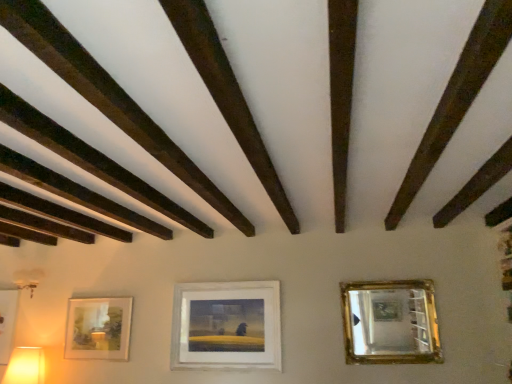
Question: Considering the positions of matte yellow plastic table lamp at lower left and dark brown wood at upper left in the image, is matte yellow plastic table lamp at lower left bigger or smaller than dark brown wood at upper left?

Choices:
 (A) small
 (B) big

Answer: (B)

Question: Considering the positions of matte yellow plastic table lamp at lower left and dark brown wood at upper left in the image, is matte yellow plastic table lamp at lower left taller or shorter than dark brown wood at upper left?

Choices:
 (A) tall
 (B) short

Answer: (A)

Question: Which of these objects is positioned closest to the gold-framed mirror at upper right?

Choices:
 (A) dark brown wood at upper left
 (B) matte white picture frame at center, arranged as the first picture frame when viewed from the right
 (C) matte white picture frame at lower left, the 2th picture frame positioned from the right
 (D) matte yellow plastic table lamp at lower left
 (E) matte white picture frame at lower left, acting as the third picture frame starting from the right

Answer: (B)

Question: Which object is the closest to the matte yellow plastic table lamp at lower left?

Choices:
 (A) matte white picture frame at center, arranged as the third picture frame when viewed from the left
 (B) dark brown wood at upper left
 (C) gold-framed mirror at upper right
 (D) matte white picture frame at lower left, which is the 2th picture frame in left-to-right order
 (E) matte white picture frame at lower left, placed as the 1th picture frame when sorted from left to right

Answer: (E)